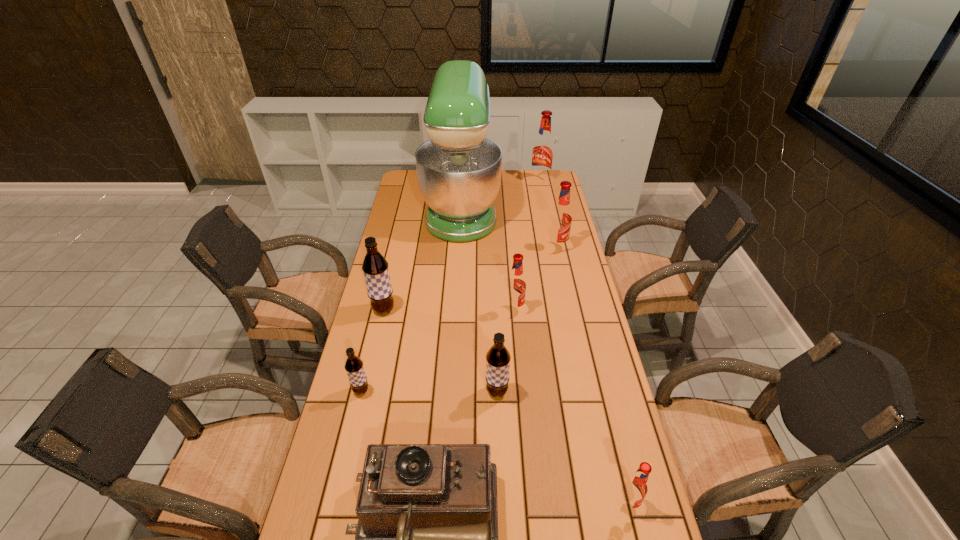
Where is `free space located on the back of the nearest root beer`? Image resolution: width=960 pixels, height=540 pixels. free space located on the back of the nearest root beer is located at coordinates (607, 416).

I want to click on vacant region located 0.240m on the back of the smallest brown root beer, so click(x=377, y=323).

Find the location of `mixer at the far edge`. mixer at the far edge is located at coordinates (459, 170).

Where is `root beer situated at the far edge`? This screenshot has width=960, height=540. root beer situated at the far edge is located at coordinates (543, 149).

Locate an element on the screen. mixer that is at the left edge is located at coordinates (459, 170).

In order to click on object that is at the far left corner in this screenshot , I will do `click(459, 170)`.

Where is `object present at the far right corner`? This screenshot has height=540, width=960. object present at the far right corner is located at coordinates (543, 149).

The image size is (960, 540). I want to click on vacant space at the far edge of the desktop, so click(x=525, y=193).

Image resolution: width=960 pixels, height=540 pixels. I want to click on free spot at the left edge of the desktop, so click(x=410, y=317).

In order to click on vacant region at the right edge of the desktop in this screenshot , I will do `click(564, 333)`.